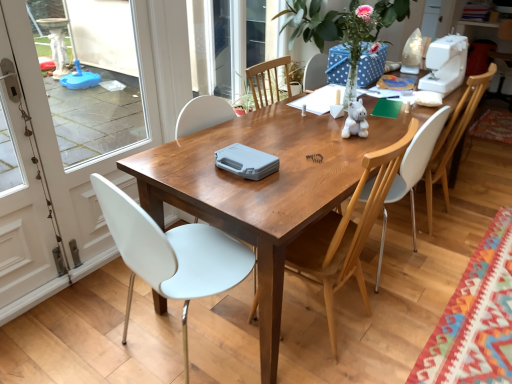
This screenshot has width=512, height=384. Find the location of `free point in front of white plastic chair at right, which appears as the first chair when viewed from the right`. free point in front of white plastic chair at right, which appears as the first chair when viewed from the right is located at coordinates (431, 244).